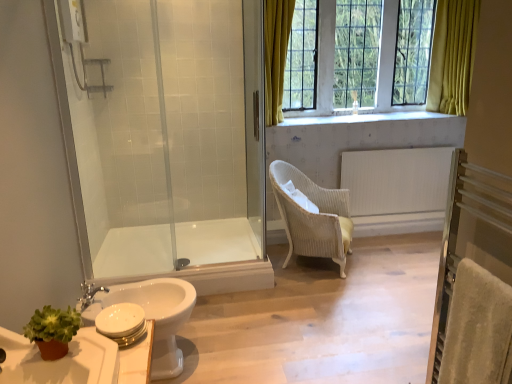
Locate an element on the screen. This screenshot has height=384, width=512. vacant space in front of beige wicker chair at center is located at coordinates (309, 302).